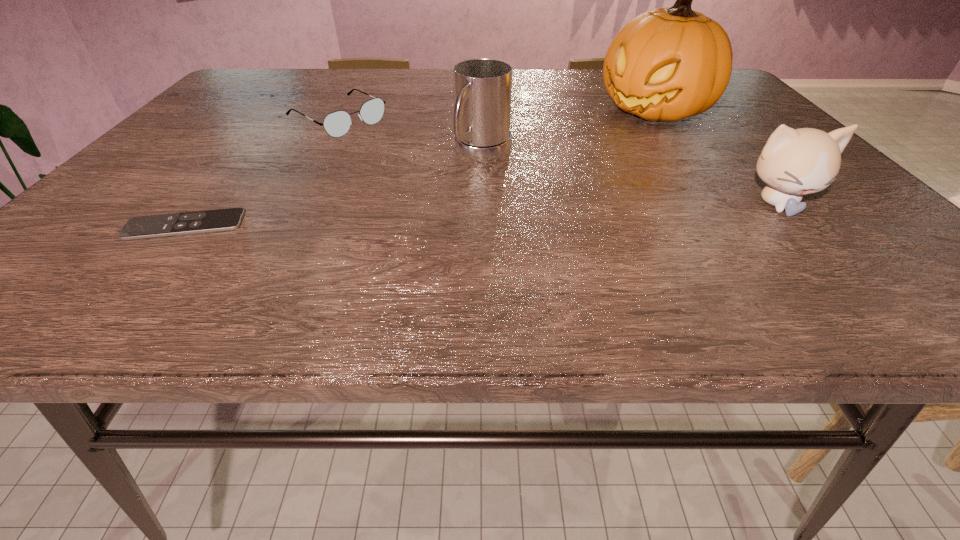
The image size is (960, 540). I want to click on vacant area in the image that satisfies the following two spatial constraints: 1. on the back side of the remote control; 2. on the left side of the tallest object, so click(279, 111).

Where is `free spot that satisfies the following two spatial constraints: 1. on the back side of the remote control; 2. on the right side of the mug`? free spot that satisfies the following two spatial constraints: 1. on the back side of the remote control; 2. on the right side of the mug is located at coordinates (244, 154).

You are a GUI agent. You are given a task and a screenshot of the screen. Output one action in this format:
    pyautogui.click(x=<x>, y=<y>)
    Task: Click on the blank area in the image that satisfies the following two spatial constraints: 1. on the back side of the spectacles; 2. on the right side of the pumpkin
    This screenshot has width=960, height=540.
    Given the screenshot: What is the action you would take?
    pyautogui.click(x=343, y=111)